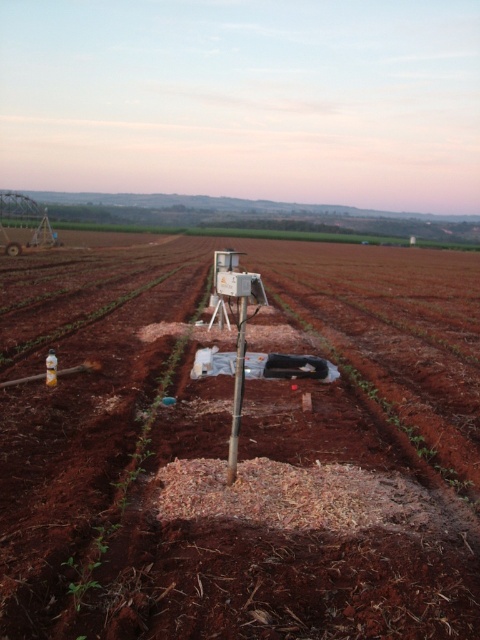
From the picture: You are a farmer checking the soil quality in the field. You have a soil testing kit that can only be used at a specific point marked as point (x=240, y=449). Where should you place your kit to test the soil quality at the center of the field?

The brown soil at center is located at point (x=240, y=449), so you should place your kit at that point to test the soil quality at the center of the field.

You are a farmer who needs to install a new irrigation system. You have a sensor that must be placed exactly 50 feet away from the brown soil at center to avoid interference. Can the metallic pole at center, which currently holds the sensor, be used for this purpose?

The distance between the brown soil at center and the metallic pole at center is 44.20 feet. Since the required distance is 50 feet, the sensor cannot be placed at the metallic pole at center as it is too close to the brown soil at center.

You are a farmer checking the field. You notice the brown soil at center and the metallic pole at center. Which one has a greater width?

The brown soil at center has a greater width than the metallic pole at center.